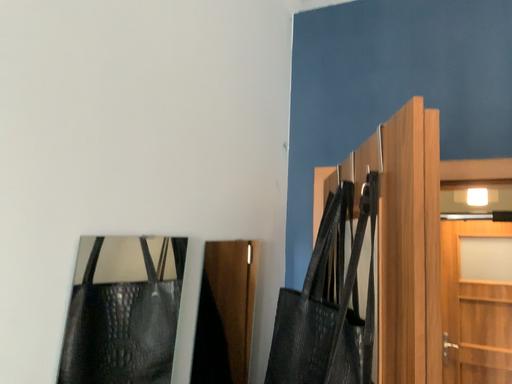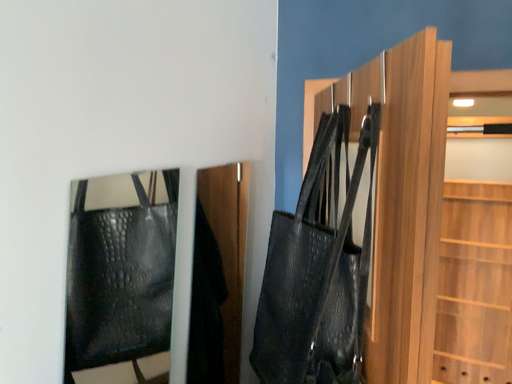
Question: Which way did the camera rotate in the video?

Choices:
 (A) rotated upward
 (B) rotated downward

Answer: (B)